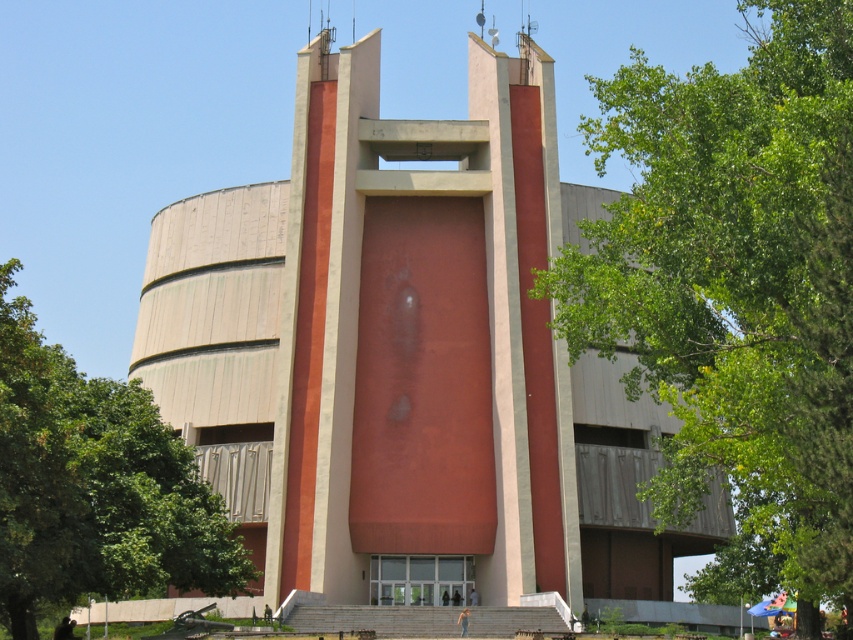
You are an architect visiting the museum and want to take a photo of both the green leafy tree at center and the green leafy tree at left. However, you can only position yourself in a spot where you can see both trees without one blocking the other. Is this possible?

The green leafy tree at center is in front of the green leafy tree at left, so you cannot see both trees without one blocking the other. Choose a different angle where neither tree obstructs the view of the other.

You are a landscape architect planning to replace the smaller green leafy tree at left with a larger one. Based on the current arrangement, will the new tree fit in the space if it grows to the same size as the green leafy tree at center?

The green leafy tree at center is wider than the green leafy tree at left. If the new tree grows to the same width as the one at center, it may not fit in the space allocated for the smaller tree at left, as the existing smaller tree is already narrower. Consider adjusting the planting area or selecting a variety that matches the current size constraints.